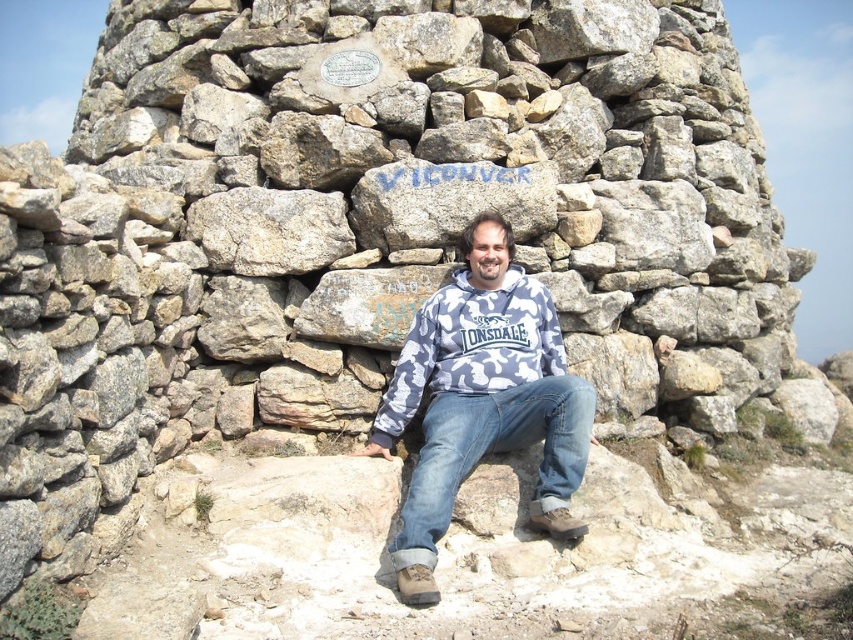
Can you confirm if blue denim jeans at center is positioned below camo fabric hoodie at center?

Correct, blue denim jeans at center is located below camo fabric hoodie at center.

How far apart are blue denim jeans at center and camo fabric hoodie at center?

blue denim jeans at center is 8.41 feet from camo fabric hoodie at center.

This screenshot has width=853, height=640. What do you see at coordinates (492, 452) in the screenshot?
I see `blue denim jeans at center` at bounding box center [492, 452].

This screenshot has height=640, width=853. In order to click on blue denim jeans at center in this screenshot , I will do `click(492, 452)`.

Between point (474, 388) and point (457, 360), which one is positioned in front?

Positioned in front is point (474, 388).

Who is positioned more to the left, camouflage hoodie at center or camo fabric hoodie at center?

camo fabric hoodie at center is more to the left.

From the picture: Who is more forward, [432,296] or [506,376]?

Positioned in front is point [506,376].

Identify the location of camouflage hoodie at center. (482, 400).

Who is positioned more to the left, camouflage hoodie at center or blue denim jeans at center?

Positioned to the left is camouflage hoodie at center.

Find the location of a particular element. The width and height of the screenshot is (853, 640). camouflage hoodie at center is located at coordinates (482, 400).

Is point (392, 417) more distant than point (426, 451)?

Yes, it is.

Identify the location of camouflage hoodie at center. The image size is (853, 640). pyautogui.click(x=482, y=400).